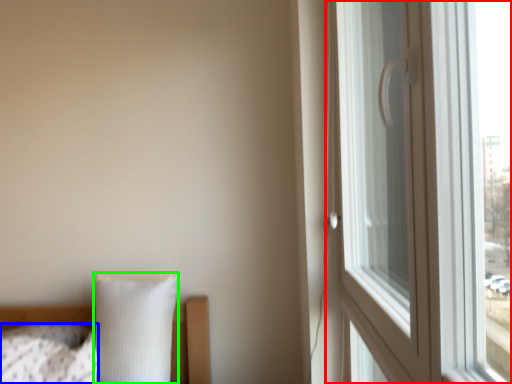
Question: Which object is the closest to the window (highlighted by a red box)? Choose among these: pillow (highlighted by a blue box) or pillow (highlighted by a green box).

Choices:
 (A) pillow
 (B) pillow

Answer: (B)